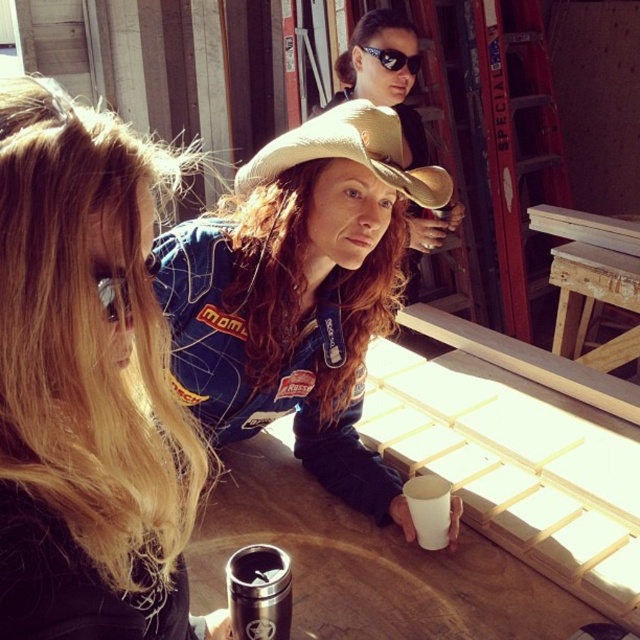
Question: Is matte blue jacket at center to the right of tan fabric cowboy hat at center from the viewer's perspective?

Choices:
 (A) yes
 (B) no

Answer: (A)

Question: Which point appears farthest from the camera in this image?

Choices:
 (A) (156, 600)
 (B) (380, 54)

Answer: (B)

Question: Is white paper cup at lower center to the left of matte black goggles at upper center from the viewer's perspective?

Choices:
 (A) yes
 (B) no

Answer: (B)

Question: Which point is farther to the camera?

Choices:
 (A) brown suede cowboy hat at upper center
 (B) matte blue jacket at center
 (C) wooden table at center

Answer: (C)

Question: Which point appears farthest from the camera in this image?

Choices:
 (A) (387, 68)
 (B) (305, 141)
 (C) (572, 252)
 (D) (408, 488)

Answer: (C)

Question: Is white wood table at center below tan fabric cowboy hat at center?

Choices:
 (A) yes
 (B) no

Answer: (A)